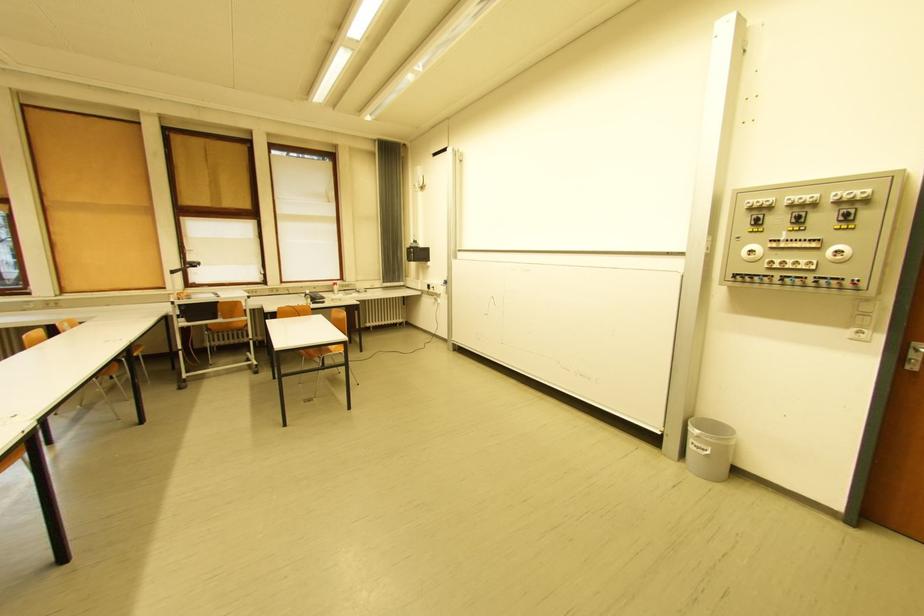
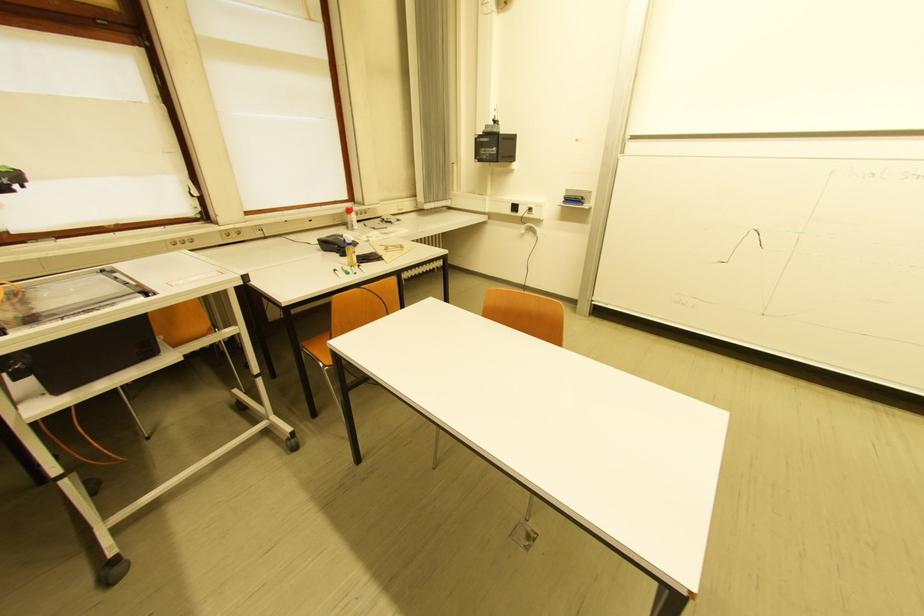
The images are taken continuously from a first-person perspective. In which direction are you moving?

The movement direction of the cameraman is left, forward.